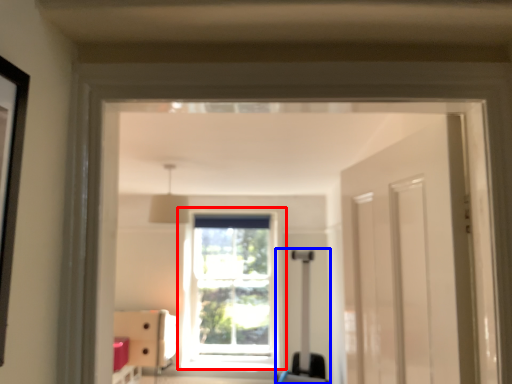
Question: Which object appears farthest to the camera in this image, window (highlighted by a red box) or luggage (highlighted by a blue box)?

Choices:
 (A) window
 (B) luggage

Answer: (A)